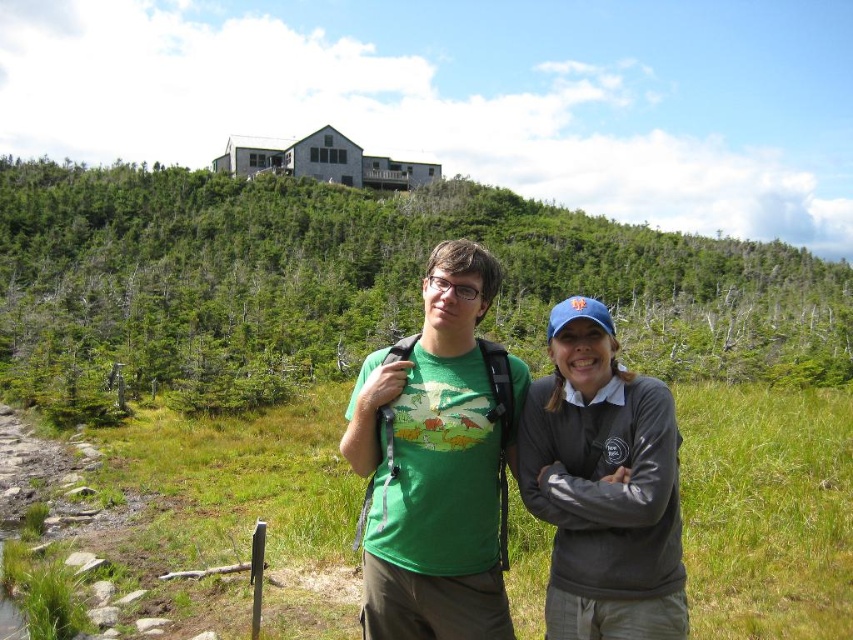
Who is positioned more to the left, green leafy hillside at upper center or green matte t-shirt at center?

green leafy hillside at upper center is more to the left.

This screenshot has height=640, width=853. Find the location of `green leafy hillside at upper center`. green leafy hillside at upper center is located at coordinates (363, 276).

I want to click on green leafy hillside at upper center, so click(363, 276).

Is green leafy hillside at upper center shorter than gray fleece jacket at center?

No.

Does green leafy hillside at upper center appear over gray fleece jacket at center?

Indeed, green leafy hillside at upper center is positioned over gray fleece jacket at center.

Who is more forward, (509, 202) or (646, 412)?

Point (646, 412) is in front.

Identify the location of green leafy hillside at upper center. Image resolution: width=853 pixels, height=640 pixels. (363, 276).

Can you confirm if gray fleece jacket at center is positioned below green matte t-shirt at center?

Yes, gray fleece jacket at center is below green matte t-shirt at center.

Does point (650, 419) come in front of point (547, 337)?

Yes, it is in front of point (547, 337).

Describe the element at coordinates (602, 484) in the screenshot. The width and height of the screenshot is (853, 640). I see `gray fleece jacket at center` at that location.

Where is `gray fleece jacket at center`? This screenshot has height=640, width=853. gray fleece jacket at center is located at coordinates (602, 484).